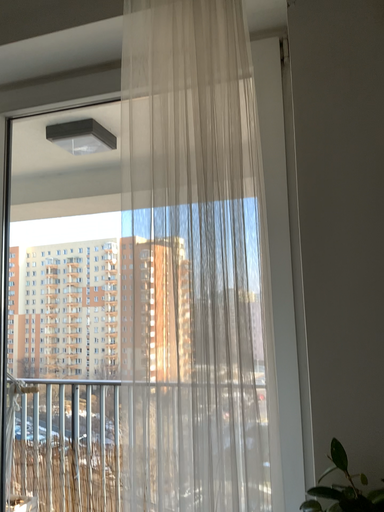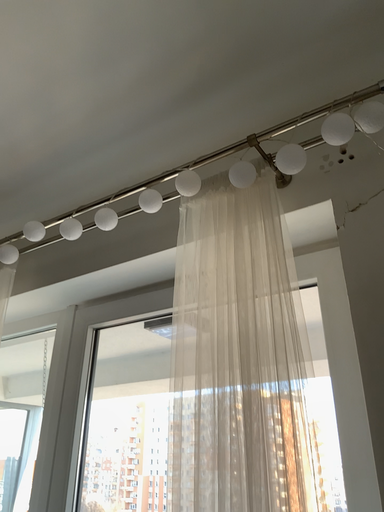
Question: How did the camera likely rotate when shooting the video?

Choices:
 (A) rotated right
 (B) rotated left

Answer: (B)